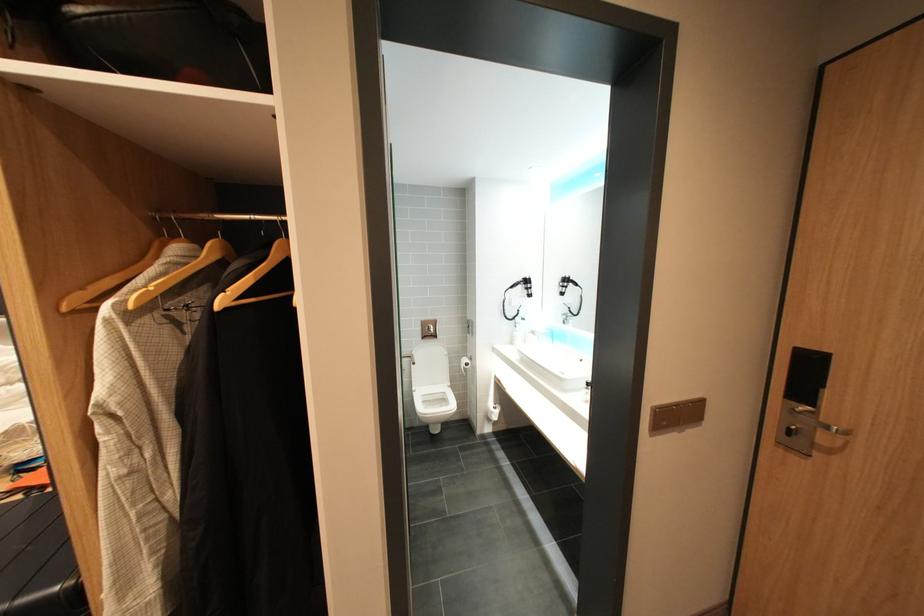
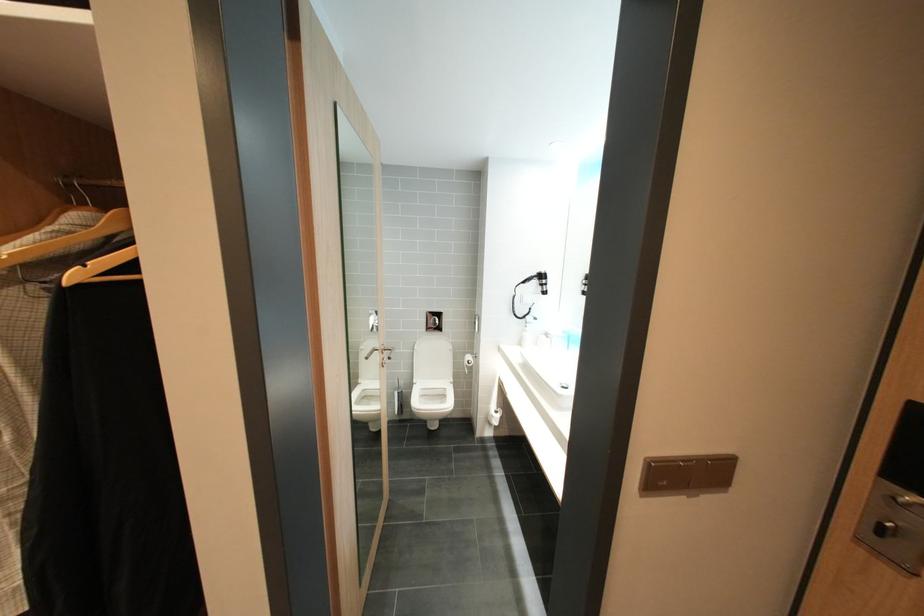
Where in the second image is the point corresponding to (660,432) from the first image?

(649, 491)